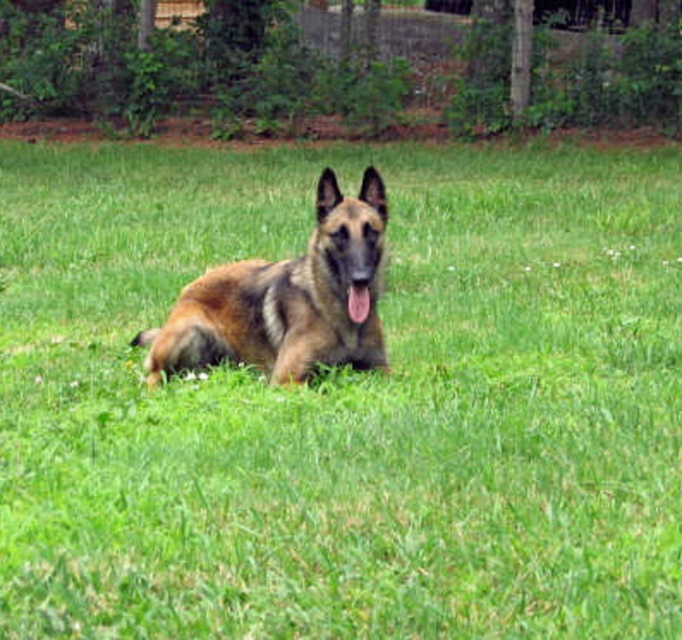
Question: Is brown fur dog at center above pink glossy tongue at center?

Choices:
 (A) no
 (B) yes

Answer: (A)

Question: Which point appears closest to the camera in this image?

Choices:
 (A) (306, 305)
 (B) (361, 314)

Answer: (B)

Question: Which of the following is the closest to the observer?

Choices:
 (A) (263, 349)
 (B) (357, 282)

Answer: (B)

Question: Can you confirm if brown fur dog at center is positioned below pink glossy tongue at center?

Choices:
 (A) yes
 (B) no

Answer: (A)

Question: Is brown fur dog at center further to the viewer compared to pink glossy tongue at center?

Choices:
 (A) yes
 (B) no

Answer: (A)